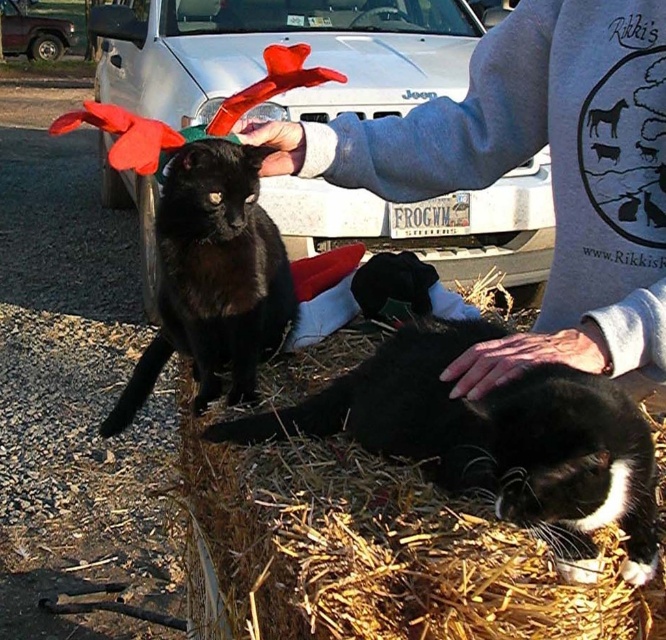
You are a photographer trying to capture a photo of the gray sweatshirt at upper center and the black matte fur cat at upper left. Based on their positions, which object should you focus on first to ensure both are in the frame?

The gray sweatshirt at upper center is located above the black matte fur cat at upper left, so you should focus on the gray sweatshirt at upper center first to ensure both are in the frame.